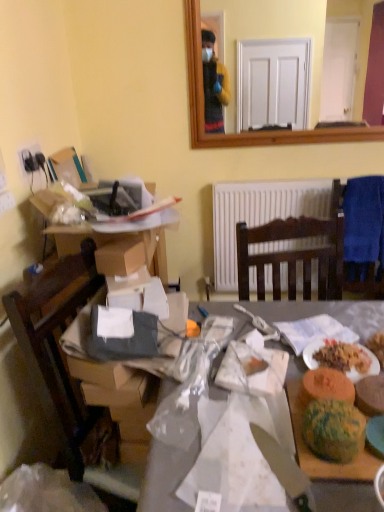
This screenshot has height=512, width=384. Identify the location of free point above white paper plate at lower right (from a real-world perspective). pyautogui.click(x=346, y=346).